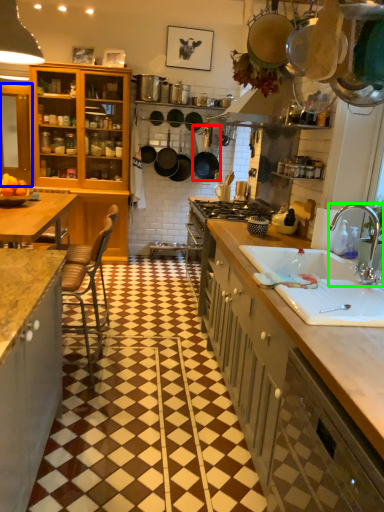
Question: Estimate the real-world distances between objects in this image. Which object is farther from kitchen appliance (highlighted by a red box), cabinetry (highlighted by a blue box) or tap (highlighted by a green box)?

Choices:
 (A) cabinetry
 (B) tap

Answer: (B)